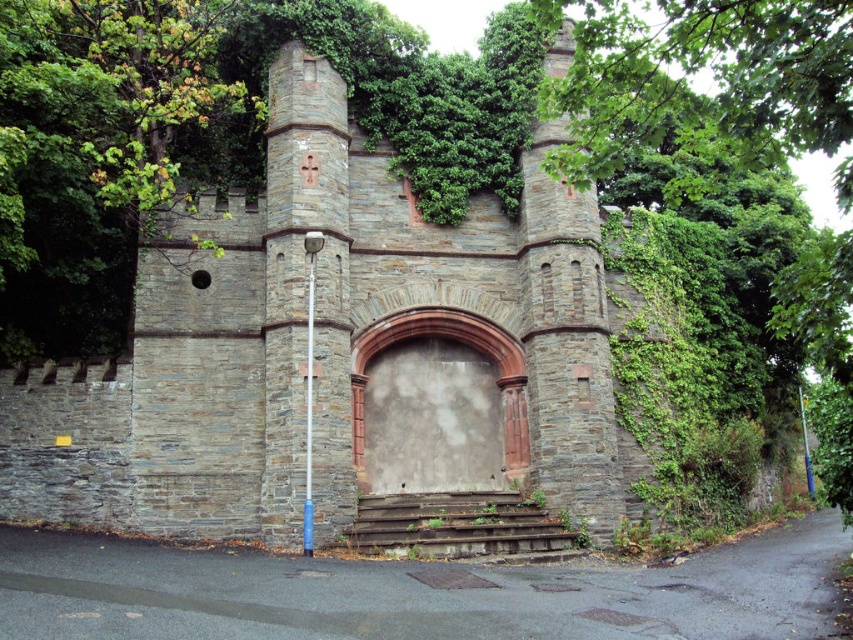
You are standing at the base of the stone structure and want to reach the arched gateway above. There is a point marked at coordinates [454,525] where rusty metal stairs at center are located. Do these stairs lead directly to the arched gateway?

Yes, the rusty metal stairs at center located at point [454,525] lead directly to the arched gateway above as they are positioned centrally under it, providing access.

You are standing at the base of the stone structure and notice a point marked at coordinates (454, 525). According to the image, what object is located at this point?

The point at (454, 525) corresponds to rusty metal stairs at center.